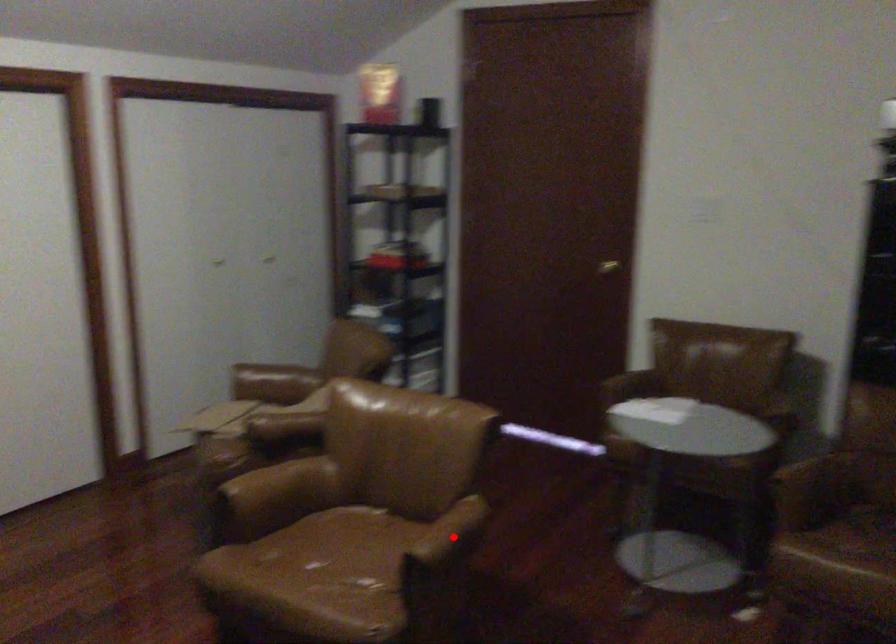
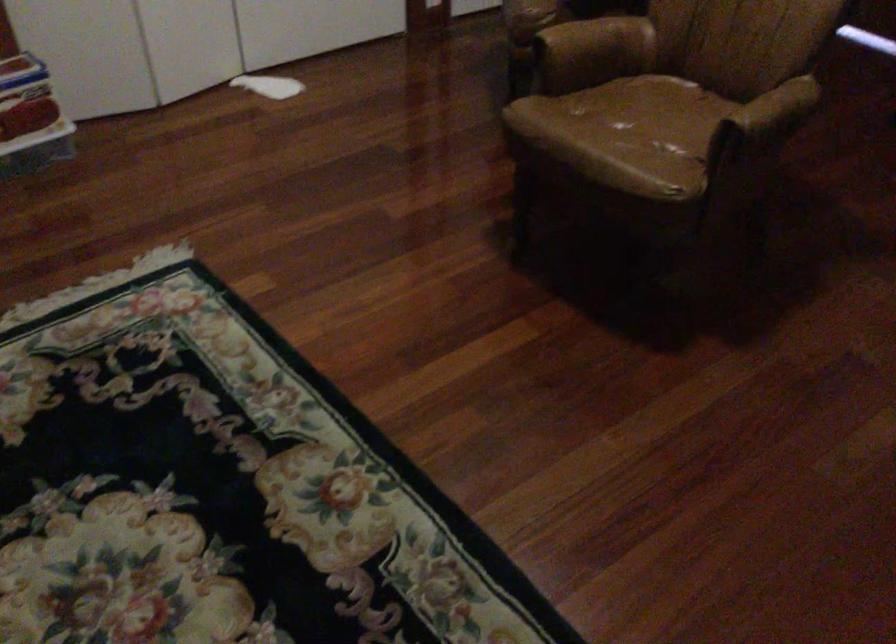
Question: I am providing you with two images of the same scene from different viewpoints. A red point is marked on the first image. At the location where the point appears in image 1, is it still visible in image 2?

Choices:
 (A) Yes
 (B) No

Answer: (A)